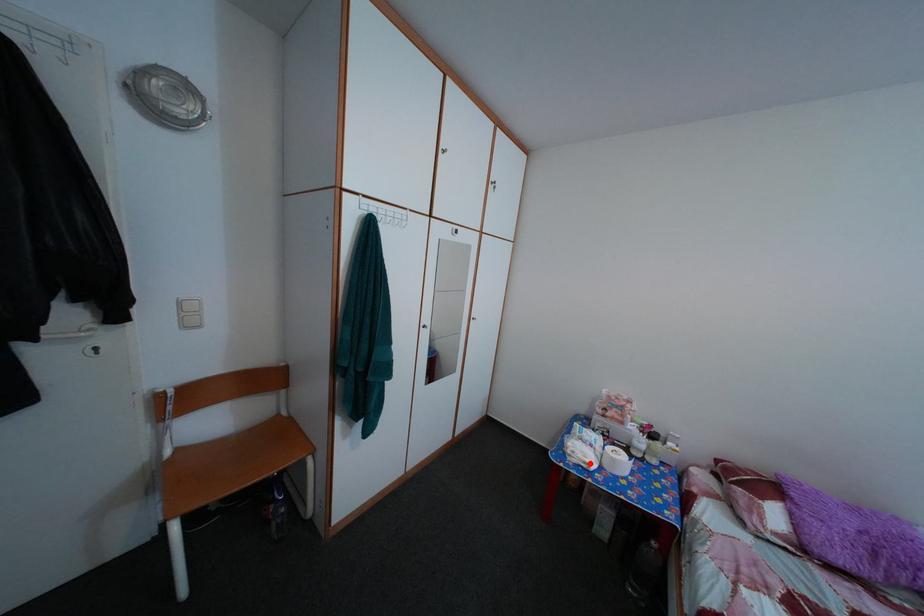
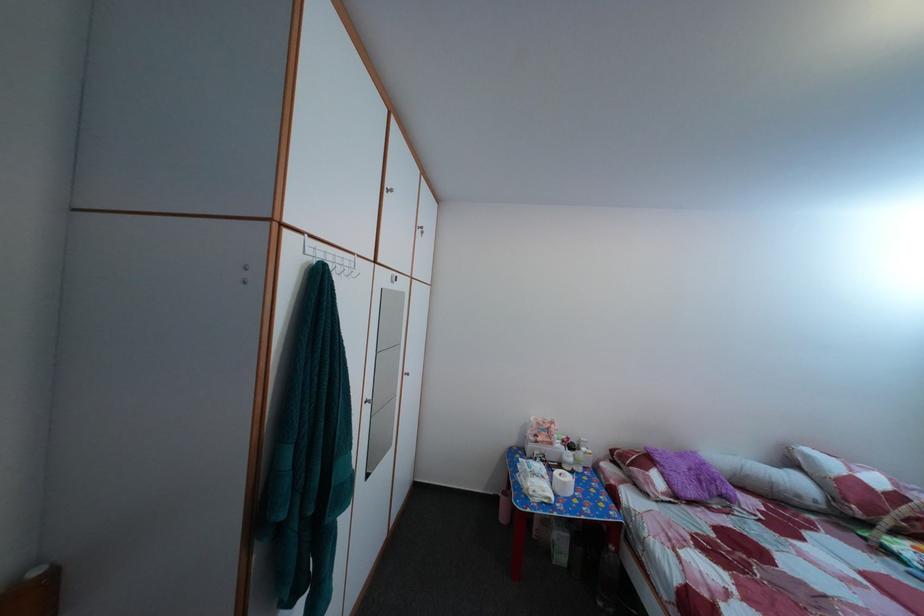
Locate, in the second image, the point that corresponds to the highlighted location in the first image.

(551, 500)